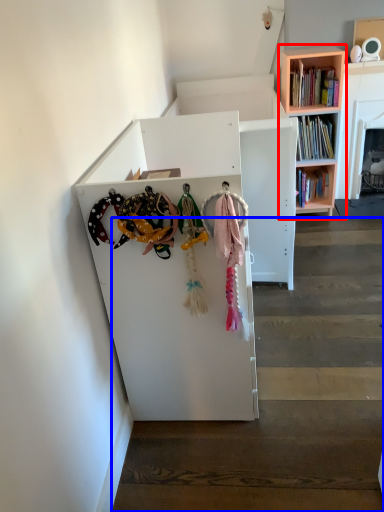
Question: Which object is further to the camera taking this photo, bookcase (highlighted by a red box) or stairwell (highlighted by a blue box)?

Choices:
 (A) bookcase
 (B) stairwell

Answer: (A)